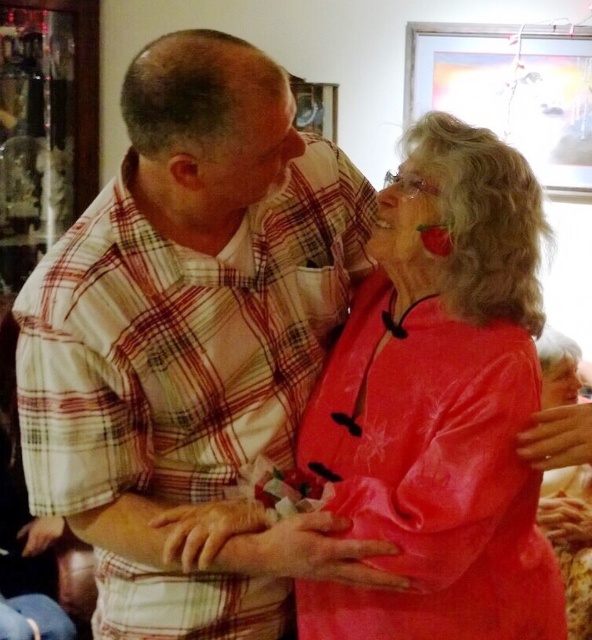
Does point (353, 456) come in front of point (429, 253)?

No, it is behind (429, 253).

Can you confirm if silky pink blouse at right is shorter than matte pink fabric at upper right?

No.

The width and height of the screenshot is (592, 640). Identify the location of silky pink blouse at right. (439, 404).

Does matte pink fabric at upper right have a greater width compared to smooth skin face at center?

In fact, matte pink fabric at upper right might be narrower than smooth skin face at center.

Can you confirm if matte pink fabric at upper right is positioned below smooth skin face at center?

No, matte pink fabric at upper right is not below smooth skin face at center.

Who is more forward, (423, 188) or (567, 369)?

Positioned in front is point (423, 188).

Locate an element on the screen. matte pink fabric at upper right is located at coordinates (407, 218).

Consider the image. Is matte plaid shirt at upper center to the right of matte pink fabric at upper right from the viewer's perspective?

Incorrect, matte plaid shirt at upper center is not on the right side of matte pink fabric at upper right.

Is matte plaid shirt at upper center smaller than matte pink fabric at upper right?

No.

Is point (239, 124) farther from viewer compared to point (378, 196)?

No, it is in front of (378, 196).

Locate an element on the screen. The width and height of the screenshot is (592, 640). matte plaid shirt at upper center is located at coordinates click(x=249, y=154).